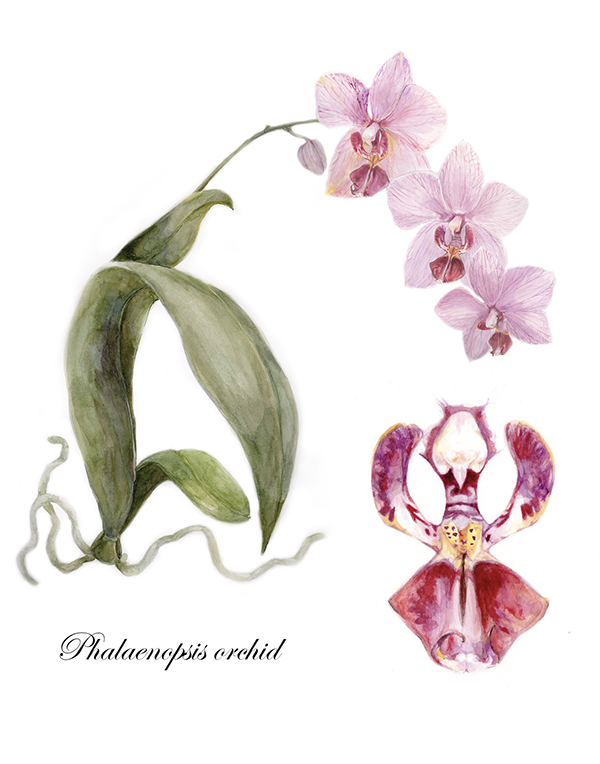
The width and height of the screenshot is (600, 764). What are the coordinates of `orchid` in the screenshot? It's located at (239, 652).